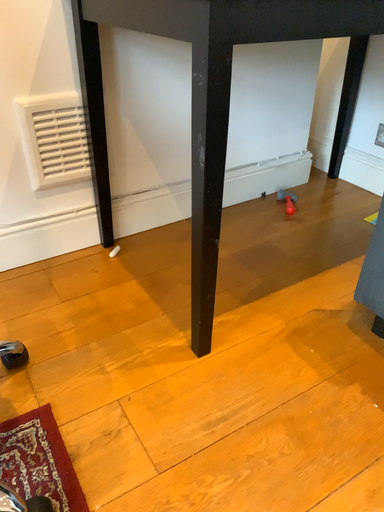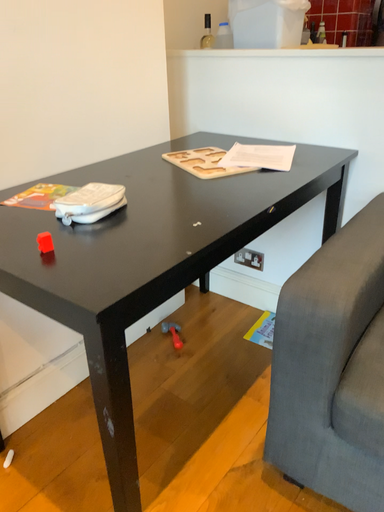
Question: How did the camera likely rotate when shooting the video?

Choices:
 (A) rotated downward
 (B) rotated upward

Answer: (B)